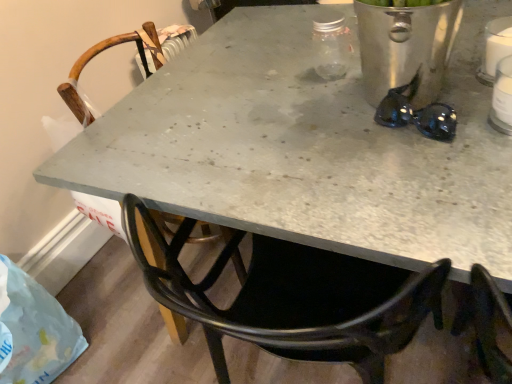
Where is `vacant space in between white plastic bottle at upper right and black shiny sunglasses at upper right`? vacant space in between white plastic bottle at upper right and black shiny sunglasses at upper right is located at coordinates (458, 110).